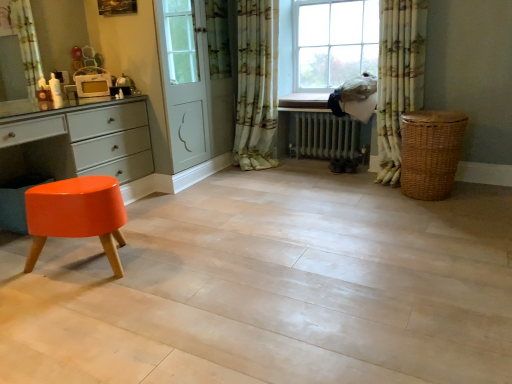
Find the location of a particular element. Image resolution: width=512 pixels, height=384 pixels. free space in front of floral fabric curtain at right, acting as the second curtain starting from the left is located at coordinates (378, 196).